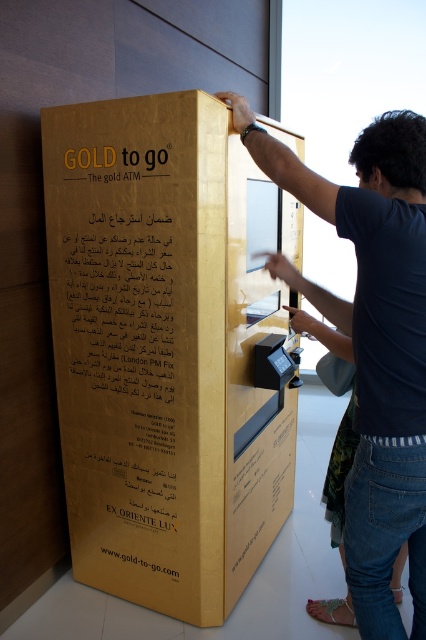
Is gold metallic atm at center to the right of dark blue shirt at center from the viewer's perspective?

In fact, gold metallic atm at center is to the left of dark blue shirt at center.

Does gold metallic atm at center have a greater width compared to dark blue shirt at center?

Correct, the width of gold metallic atm at center exceeds that of dark blue shirt at center.

Where is `gold metallic atm at center`? This screenshot has width=426, height=640. gold metallic atm at center is located at coordinates (167, 349).